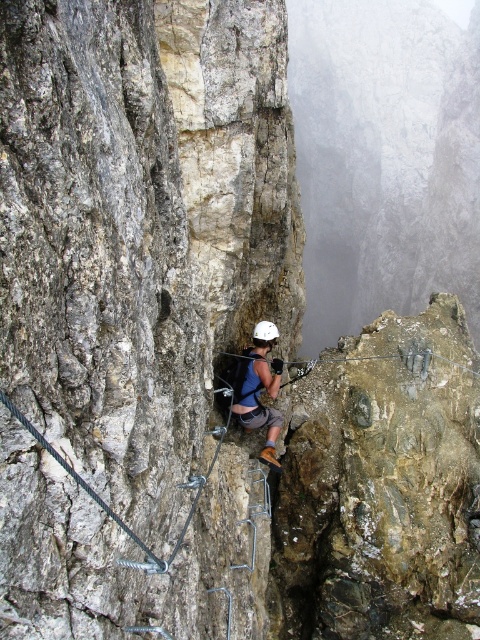
Question: Does gray rock at center come behind blue fabric helmet at center?

Choices:
 (A) no
 (B) yes

Answer: (A)

Question: Which of these objects is positioned closest to the blue fabric helmet at center?

Choices:
 (A) white matte helmet at center
 (B) gray rock at center

Answer: (A)

Question: Is blue fabric helmet at center positioned at the back of white matte helmet at center?

Choices:
 (A) yes
 (B) no

Answer: (B)

Question: Among these points, which one is farthest from the camera?

Choices:
 (A) (180, 598)
 (B) (260, 323)

Answer: (B)

Question: Is gray rock at center thinner than white matte helmet at center?

Choices:
 (A) yes
 (B) no

Answer: (B)

Question: Which of the following is the farthest from the observer?

Choices:
 (A) (260, 339)
 (B) (83, 198)

Answer: (A)